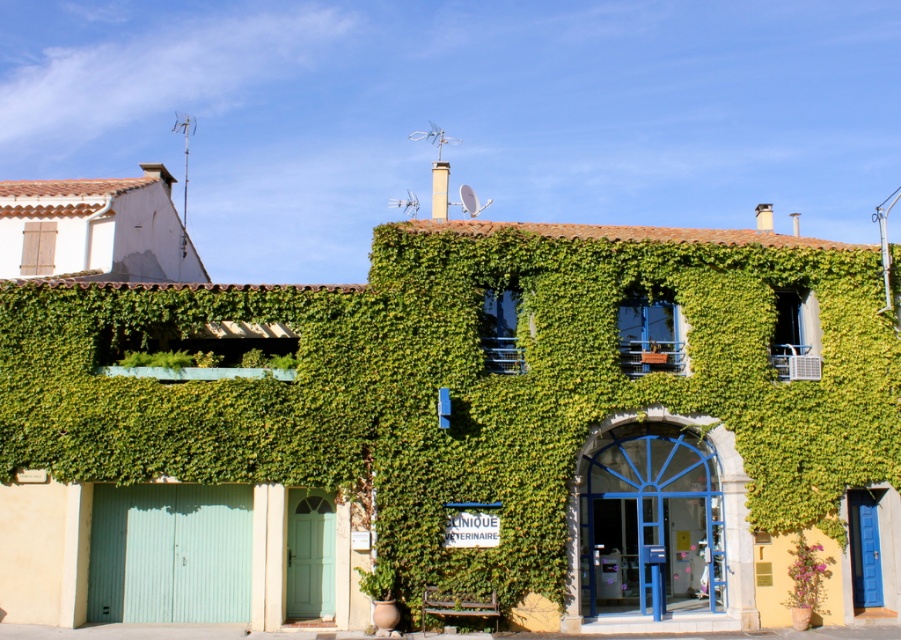
Is blue painted wood at lower left above teal matte/glossy garage door at lower left?

Yes.

This screenshot has height=640, width=901. Describe the element at coordinates (651, 522) in the screenshot. I see `blue painted wood at lower left` at that location.

The height and width of the screenshot is (640, 901). What are the coordinates of `blue painted wood at lower left` in the screenshot? It's located at (651, 522).

Can you confirm if blue painted wood at lower left is thinner than pink flower pot at lower right?

No, blue painted wood at lower left is not thinner than pink flower pot at lower right.

Looking at this image, who is more distant from viewer, [622,509] or [829,561]?

The point [622,509] is behind.

Where is `blue painted wood at lower left`? The width and height of the screenshot is (901, 640). blue painted wood at lower left is located at coordinates (651, 522).

Which of these two, teal matte/glossy garage door at lower left or pink flower pot at lower right, stands shorter?

Standing shorter between the two is pink flower pot at lower right.

In the scene shown: Does teal matte/glossy garage door at lower left appear over pink flower pot at lower right?

Correct, teal matte/glossy garage door at lower left is located above pink flower pot at lower right.

Between point (165, 611) and point (802, 540), which one is positioned behind?

The point (802, 540) is more distant.

Locate an element on the screen. Image resolution: width=901 pixels, height=640 pixels. teal matte/glossy garage door at lower left is located at coordinates (169, 552).